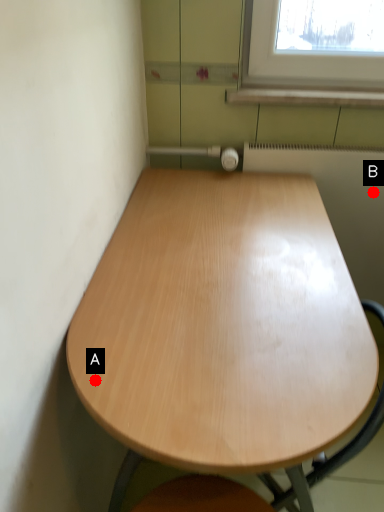
Question: Two points are circled on the image, labeled by A and B beside each circle. Which point is closer to the camera?

Choices:
 (A) A is closer
 (B) B is closer

Answer: (A)